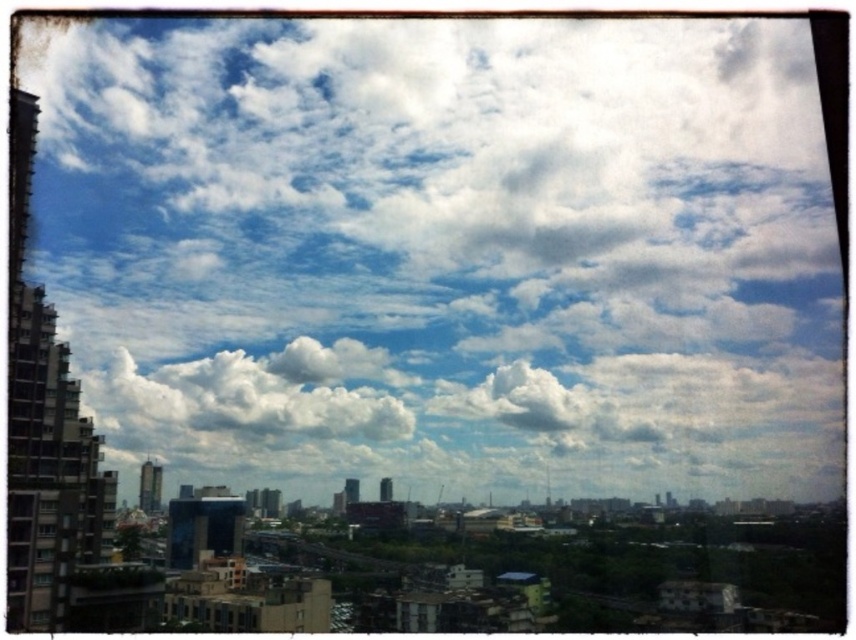
You are standing at the center of the city square and see two points in the urban landscape. The first point is labeled as point (598, 77) and the second is point (143, 428). Which point is closer to you?

Point (598, 77) is in front of point (143, 428), so it is closer to you.

You are an architect designing a new skyscraper in the city. You want to ensure the building doesn not block the view of the white fluffy cloud at upper center and the white fluffy cloud at center from the ground. Which cloud should you prioritize keeping visible to avoid obstruction?

The white fluffy cloud at upper center is located above the white fluffy cloud at center. Since it is higher up, prioritizing its visibility would also ensure the lower cloud remains visible, so you should prioritize keeping the white fluffy cloud at upper center visible.

You are standing at the base of the tallest building in the city, looking up at the white fluffy cloud at upper center. If you have a laser pointer that can reach 100 meters, will you be able to shine it on the cloud?

The distance between the white fluffy cloud at upper center and the viewer is 85.13 meters, which is less than the laser pointer range of 100 meters. Therefore, you can shine the laser pointer on the cloud.